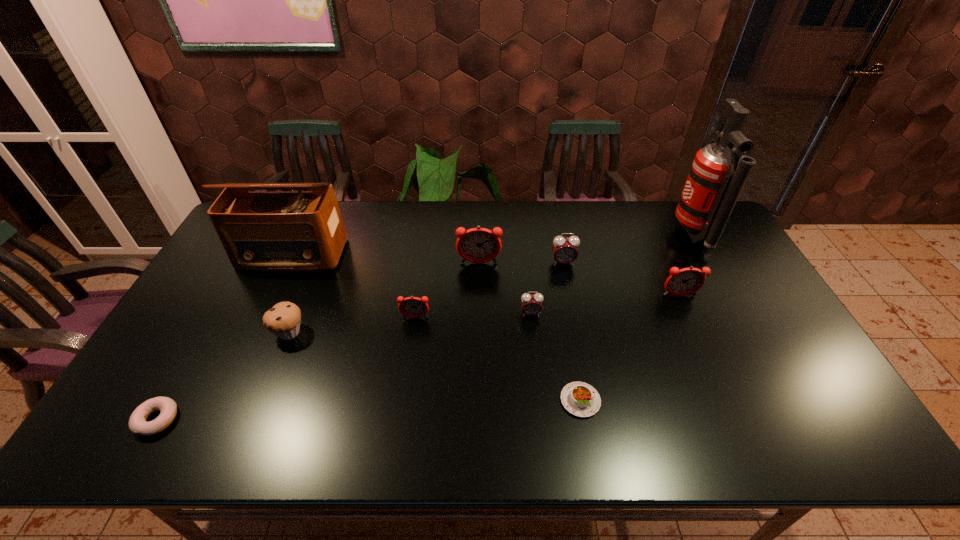
This screenshot has height=540, width=960. I want to click on vacant space located on the front-facing side of the eighth shortest object, so click(479, 365).

Identify the location of free space located 0.050m on the clock face of the fourth alarm clock from left to right. This screenshot has width=960, height=540. (566, 278).

Identify the location of vacant space located 0.170m on the front-facing side of the rightmost alarm clock. This screenshot has width=960, height=540. (701, 345).

You are a GUI agent. You are given a task and a screenshot of the screen. Output one action in this format:
    pyautogui.click(x=<x>, y=<y>)
    Task: Click on the vacant area located 0.180m on the back of the muffin
    
    Given the screenshot: What is the action you would take?
    pyautogui.click(x=312, y=275)

This screenshot has height=540, width=960. Identify the location of free location located 0.070m on the clock face of the third alarm clock from right to left. (533, 338).

I want to click on blank space located on the front-facing side of the leftmost alarm clock, so click(x=405, y=392).

I want to click on blank space located 0.150m on the left of the pudding, so click(x=499, y=401).

What are the coordinates of `vacant area situated on the right of the doughnut` in the screenshot? It's located at (258, 420).

This screenshot has width=960, height=540. I want to click on fire extinguisher that is at the far edge, so click(x=718, y=174).

Where is `radio receiver present at the far edge`? The height and width of the screenshot is (540, 960). radio receiver present at the far edge is located at coordinates (x=290, y=231).